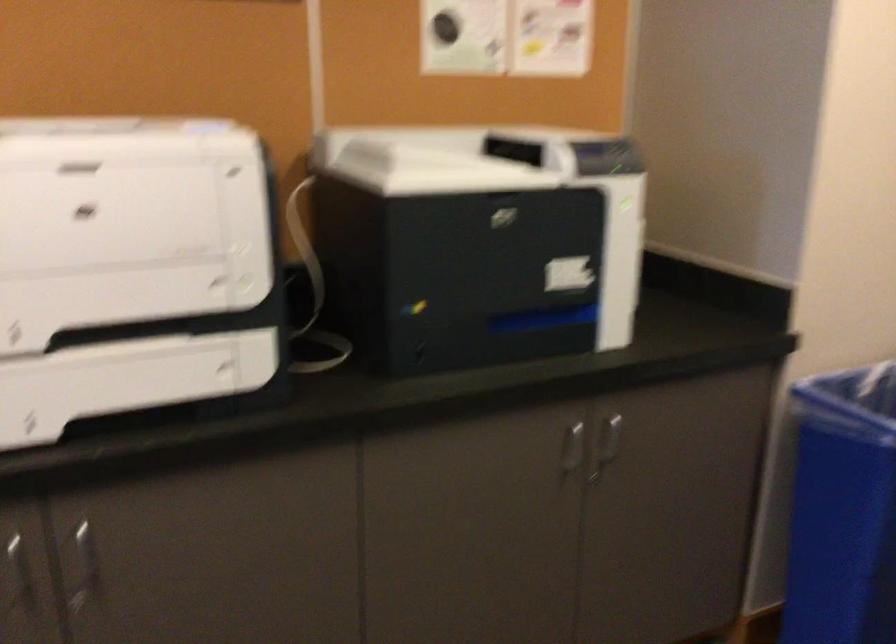
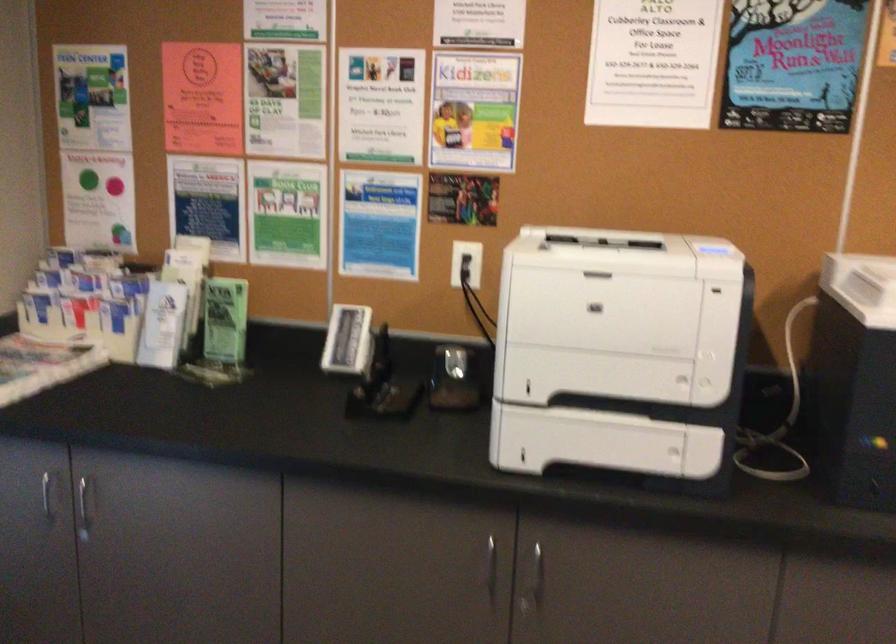
Question: The first image is from the beginning of the video and the second image is from the end. How did the camera likely rotate when shooting the video?

Choices:
 (A) Left
 (B) Right
 (C) Up
 (D) Down

Answer: (A)